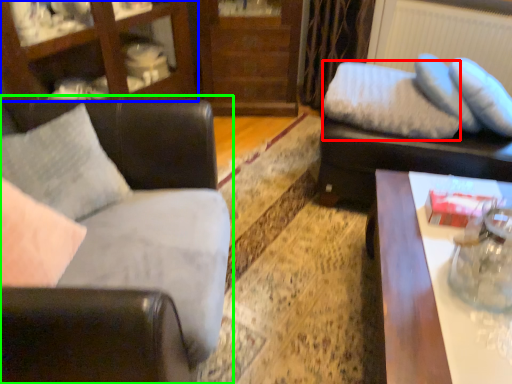
Question: Estimate the real-world distances between objects in this image. Which object is farther from pillow (highlighted by a red box), entertainment center (highlighted by a blue box) or studio couch (highlighted by a green box)?

Choices:
 (A) entertainment center
 (B) studio couch

Answer: (A)